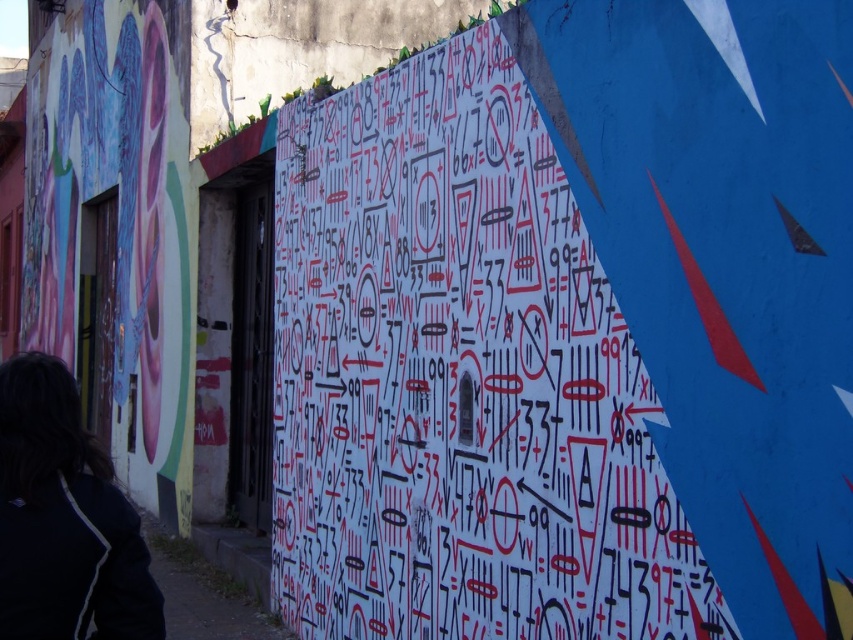
Question: Where is white paper with red and black markings at center located in relation to black fabric at lower left in the image?

Choices:
 (A) above
 (B) below

Answer: (A)

Question: Which object appears farthest from the camera in this image?

Choices:
 (A) white paper with red and black markings at center
 (B) black fabric at lower left

Answer: (A)

Question: Which object is closer to the camera taking this photo?

Choices:
 (A) black fabric at lower left
 (B) white paper with red and black markings at center

Answer: (A)

Question: Is white paper with red and black markings at center to the left of black fabric at lower left from the viewer's perspective?

Choices:
 (A) no
 (B) yes

Answer: (A)

Question: Considering the relative positions of white paper with red and black markings at center and black fabric at lower left in the image provided, where is white paper with red and black markings at center located with respect to black fabric at lower left?

Choices:
 (A) right
 (B) left

Answer: (A)

Question: Which object is closer to the camera taking this photo?

Choices:
 (A) white paper with red and black markings at center
 (B) black fabric at lower left

Answer: (B)